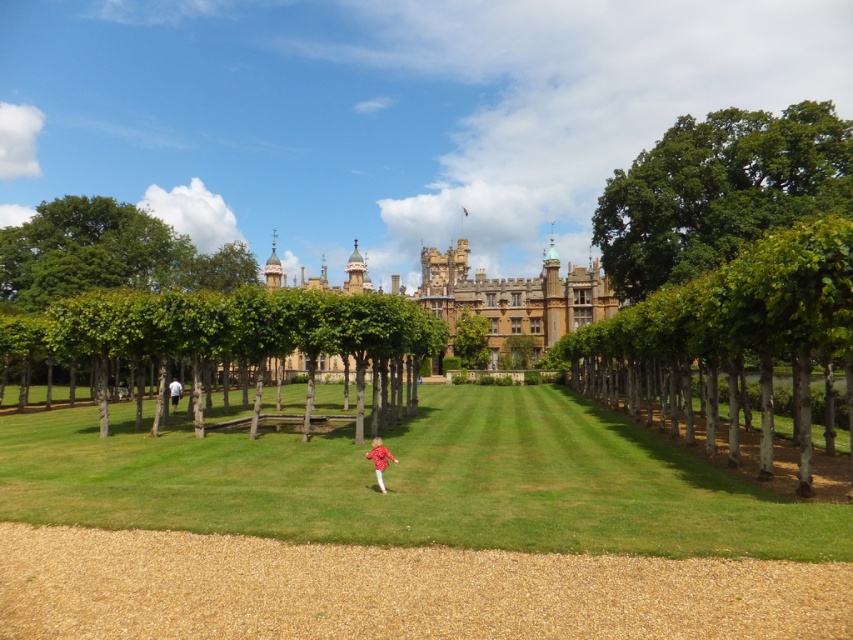
Between green leafy trees at center and green leafy tree at center, which one has less height?

green leafy tree at center

This screenshot has height=640, width=853. I want to click on green leafy trees at center, so click(231, 332).

Identify the location of green leafy trees at center. The image size is (853, 640). (231, 332).

Who is positioned more to the left, green smooth tree at right or green leafy trees at center?

green leafy trees at center

This screenshot has height=640, width=853. What do you see at coordinates (730, 337) in the screenshot?
I see `green smooth tree at right` at bounding box center [730, 337].

Who is more forward, (660,424) or (283,324)?

Point (283,324)

Find the location of a particular element. The height and width of the screenshot is (640, 853). green smooth tree at right is located at coordinates (730, 337).

What do you see at coordinates (393, 589) in the screenshot? I see `brown gravel at lower center` at bounding box center [393, 589].

Measure the distance between point (651,592) and camera.

A distance of 86.42 meters exists between point (651,592) and camera.

Locate an element on the screen. Image resolution: width=853 pixels, height=640 pixels. brown gravel at lower center is located at coordinates (393, 589).